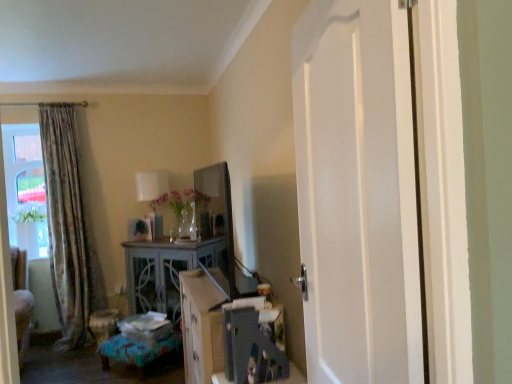
Question: Is point (148, 190) closer or farther from the camera than point (166, 263)?

Choices:
 (A) closer
 (B) farther

Answer: (B)

Question: Would you say white fabric lampshade at upper center is to the left or to the right of distressed wood cabinet at center in the picture?

Choices:
 (A) left
 (B) right

Answer: (A)

Question: Which is nearer to the floral fabric curtain at left?

Choices:
 (A) clear glass vase at center
 (B) textured blue fabric ottoman at lower center
 (C) white smooth door at center
 (D) distressed wood cabinet at center
 (E) white fabric lampshade at upper center

Answer: (D)

Question: Which is farther from the textured blue fabric ottoman at lower center?

Choices:
 (A) white fabric lampshade at upper center
 (B) white smooth door at center
 (C) clear glass vase at center
 (D) floral fabric curtain at left
 (E) distressed wood cabinet at center

Answer: (B)